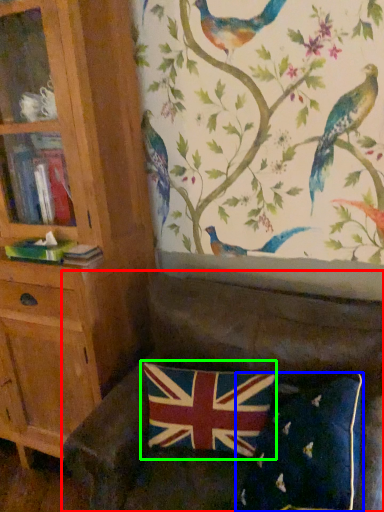
Question: Which object is positioned farthest from studio couch (highlighted by a red box)? Select from pillow (highlighted by a blue box) and flag (highlighted by a green box).

Choices:
 (A) pillow
 (B) flag

Answer: (A)